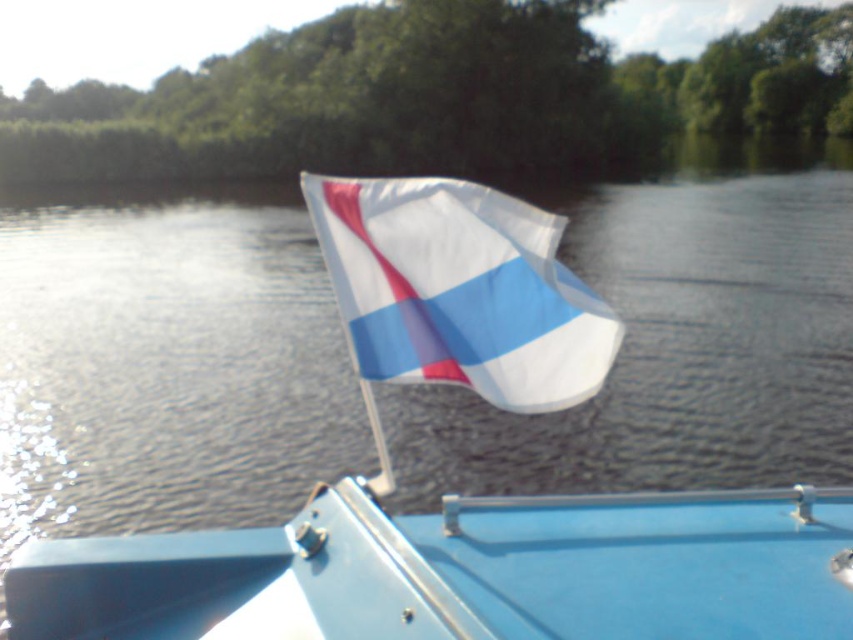
You are standing on the dock and want to board the blue matte boat at center. The dock is 5 feet away from where you are. Can you reach the boat from your current position?

The blue matte boat at center is 6.16 feet away from the viewer. Since the dock is only 5 feet away from you, you are still 1.16 feet away from the boat and cannot reach it from your current position.

You are on a boat and want to determine the distance between two points marked on the water surface. The points are labeled as point 1 at coordinates point (668, 600) and point 2 at coordinates point (474, 324). Given that point 1 is closer to you than point 2, which point would appear larger in your field of view?

Point 1 at coordinates point (668, 600) appears larger because it is closer to the viewer than point 2 at coordinates point (474, 324).

You are a passenger on the blue matte boat at center and want to grab the white fabric flag at center. Can you reach it from your current position?

The distance between the blue matte boat at center and the white fabric flag at center is 23.33 inches, so yes, you can reach the white fabric flag at center from the blue matte boat at center as 23.33 inches is within a typical arm reach distance.